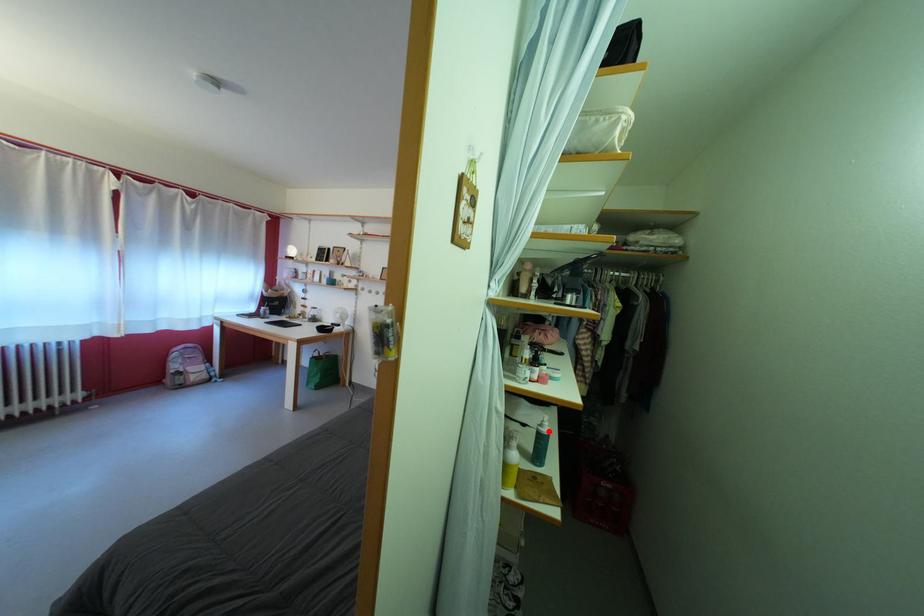
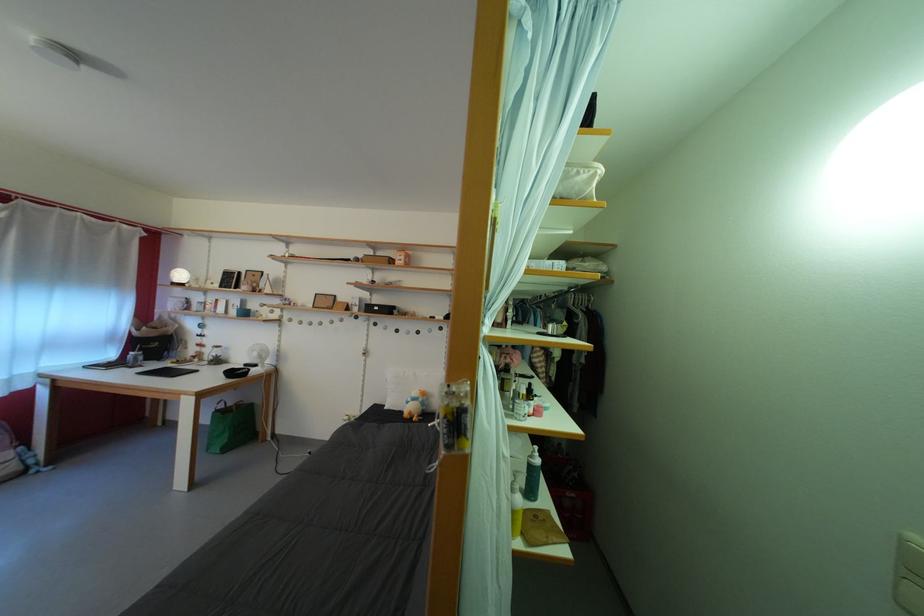
Question: I am providing you with two images of the same scene from different viewpoints. In image1, a red point is highlighted. Considering the same 3D point in image2, which of the following is correct?

Choices:
 (A) It is closer
 (B) It is farther

Answer: (B)